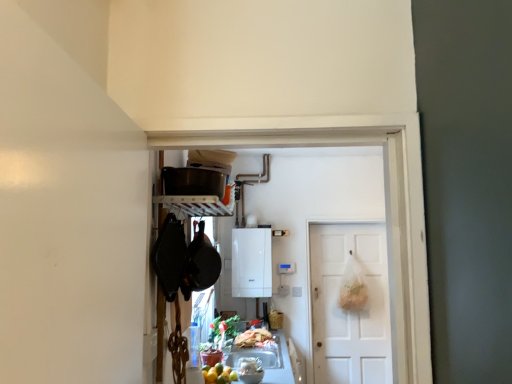
Question: Could you tell me if shiny plastic bag of food at lower center is facing white matte door at center?

Choices:
 (A) no
 (B) yes

Answer: (A)

Question: From a real-world perspective, is shiny plastic bag of food at lower center located higher than white matte door at center?

Choices:
 (A) no
 (B) yes

Answer: (A)

Question: Is there a large distance between shiny plastic bag of food at lower center and white matte door at center?

Choices:
 (A) yes
 (B) no

Answer: (A)

Question: From the image's perspective, would you say shiny plastic bag of food at lower center is positioned over white matte door at center?

Choices:
 (A) yes
 (B) no

Answer: (B)

Question: Is white matte door at center inside shiny plastic bag of food at lower center?

Choices:
 (A) yes
 (B) no

Answer: (B)

Question: Considering the positions of white glossy countertop at lower center and matte black pot at upper center in the image, is white glossy countertop at lower center taller or shorter than matte black pot at upper center?

Choices:
 (A) short
 (B) tall

Answer: (B)

Question: Which is correct: white glossy countertop at lower center is inside matte black pot at upper center, or outside of it?

Choices:
 (A) outside
 (B) inside

Answer: (A)

Question: Is white glossy countertop at lower center in front of or behind matte black pot at upper center in the image?

Choices:
 (A) behind
 (B) front

Answer: (A)

Question: From the image's perspective, relative to matte black pot at upper center, is white glossy countertop at lower center above or below?

Choices:
 (A) below
 (B) above

Answer: (A)

Question: Looking at their shapes, would you say matte black pot at upper center is wider or thinner than white matte door at center?

Choices:
 (A) thin
 (B) wide

Answer: (B)

Question: Is matte black pot at upper center taller or shorter than white matte door at center?

Choices:
 (A) short
 (B) tall

Answer: (A)

Question: Considering the relative positions of matte black pot at upper center and white matte door at center in the image provided, is matte black pot at upper center to the left or to the right of white matte door at center?

Choices:
 (A) right
 (B) left

Answer: (B)

Question: In the image, is matte black pot at upper center positioned in front of or behind white matte door at center?

Choices:
 (A) behind
 (B) front

Answer: (B)

Question: Does point (336, 253) appear closer or farther from the camera than point (220, 175)?

Choices:
 (A) farther
 (B) closer

Answer: (A)

Question: From the image's perspective, relative to matte black pot at upper center, is white matte door at center above or below?

Choices:
 (A) below
 (B) above

Answer: (A)